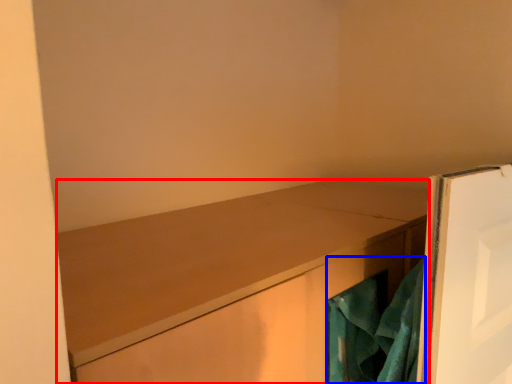
Question: Which of the following is the farthest to the observer, cabinetry (highlighted by a red box) or laundry (highlighted by a blue box)?

Choices:
 (A) cabinetry
 (B) laundry

Answer: (B)